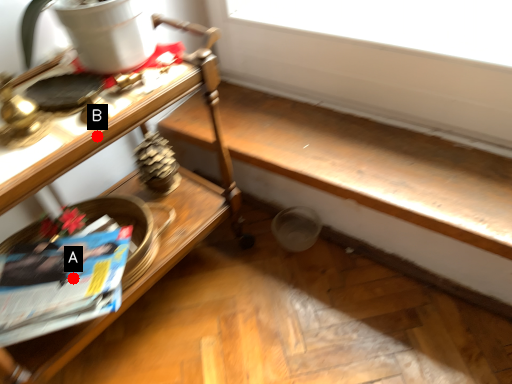
Question: Two points are circled on the image, labeled by A and B beside each circle. Among these points, which one is nearest to the camera?

Choices:
 (A) A is closer
 (B) B is closer

Answer: (B)